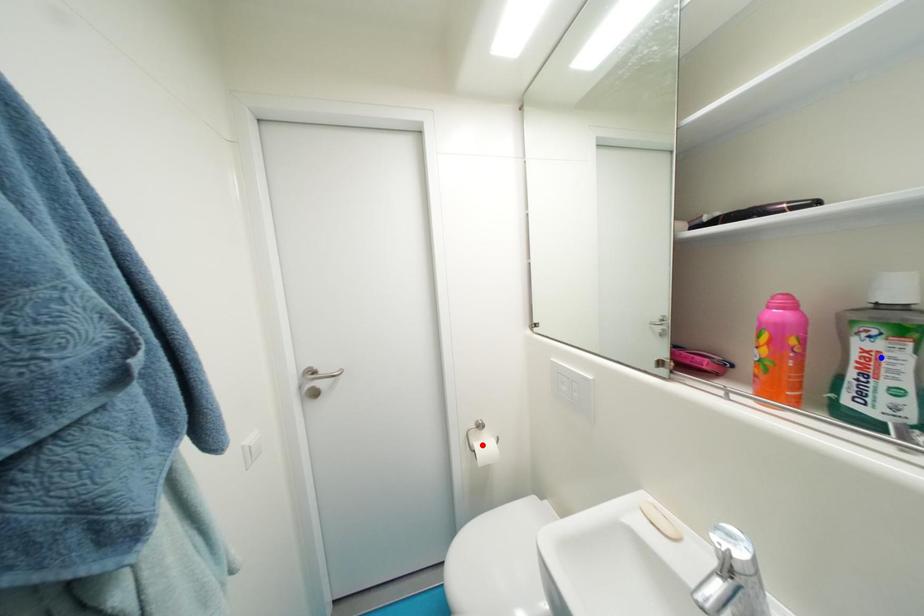
Question: In the image, two points are highlighted. Which point is nearer to the camera? Reply with the corresponding letter.

Choices:
 (A) blue point
 (B) red point

Answer: (A)